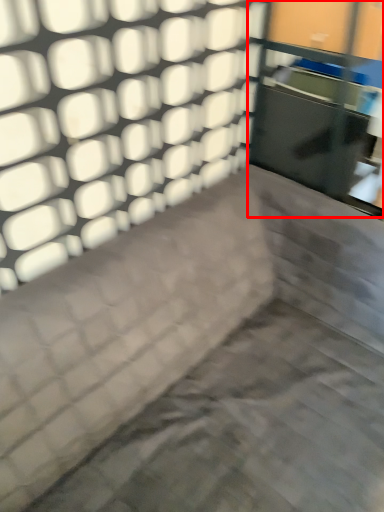
Question: Considering the relative positions of glass door (annotated by the red box) and furniture in the image provided, where is glass door (annotated by the red box) located with respect to the staircase?

Choices:
 (A) right
 (B) left

Answer: (A)